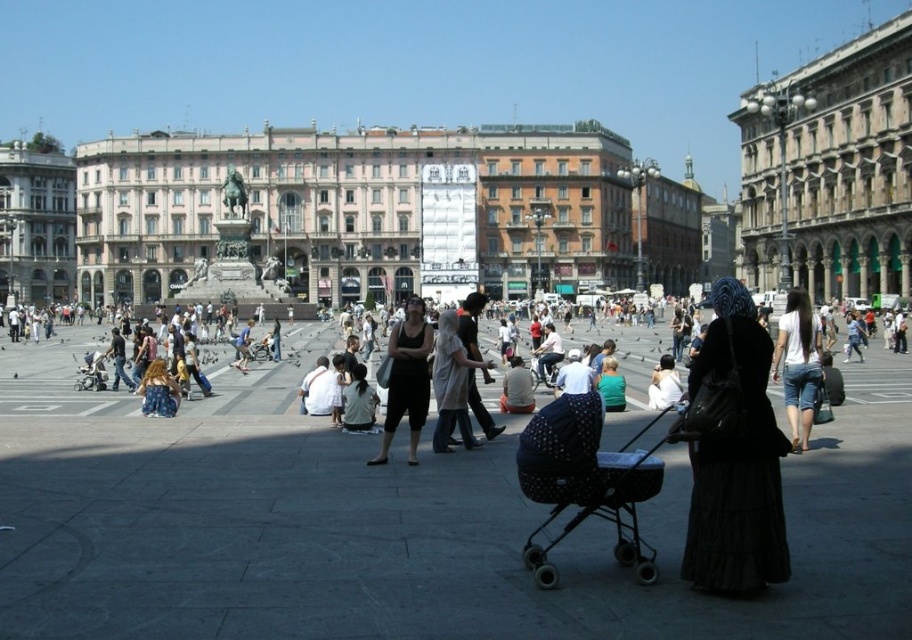
Question: Can you confirm if polka dot fabric baby carriage at center is wider than denim skirt at lower left?

Choices:
 (A) yes
 (B) no

Answer: (A)

Question: Does polka dot fabric baby carriage at center have a smaller size compared to denim skirt at lower left?

Choices:
 (A) yes
 (B) no

Answer: (B)

Question: Which point is closer to the camera?

Choices:
 (A) (400, 353)
 (B) (706, 472)
 (C) (794, 324)
 (D) (617, 520)

Answer: (B)

Question: Based on their relative distances, which object is farther from the polka dot fabric baby carriage at center?

Choices:
 (A) matte black tank top at center
 (B) beige stone building at right
 (C) beige stone palace at center
 (D) white cotton shirt at center

Answer: (C)

Question: Which of the following is the farthest from the observer?

Choices:
 (A) beige stone building at right
 (B) denim skirt at lower left
 (C) white cotton shirt at center
 (D) black fabric dress at center

Answer: (A)

Question: Does beige stone palace at center have a lesser width compared to denim skirt at lower left?

Choices:
 (A) no
 (B) yes

Answer: (A)